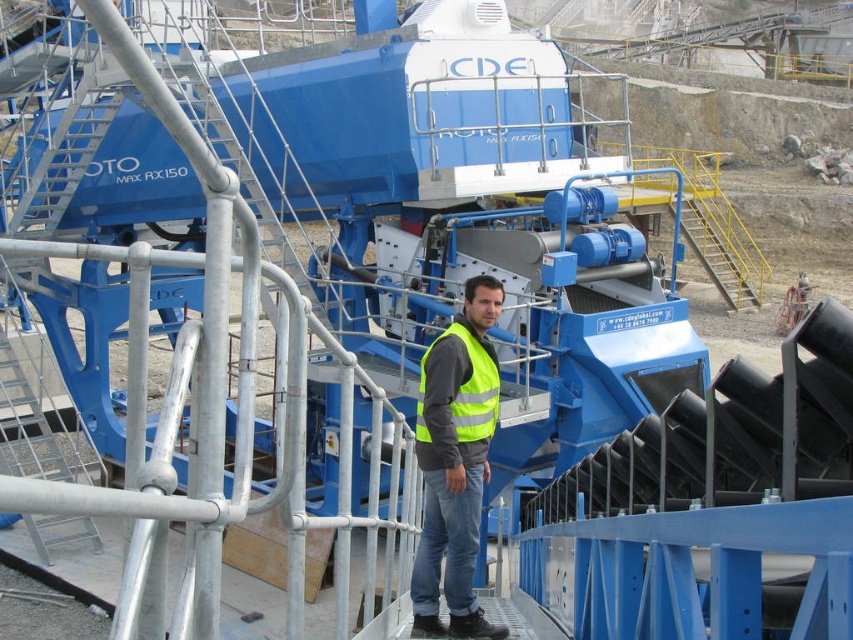
Question: Is high visibility yellow vest at center bigger than yellow reflective safety vest at center?

Choices:
 (A) yes
 (B) no

Answer: (A)

Question: Does high visibility yellow vest at center have a smaller size compared to yellow reflective safety vest at center?

Choices:
 (A) no
 (B) yes

Answer: (A)

Question: Is high visibility yellow vest at center to the left of yellow reflective safety vest at center from the viewer's perspective?

Choices:
 (A) yes
 (B) no

Answer: (B)